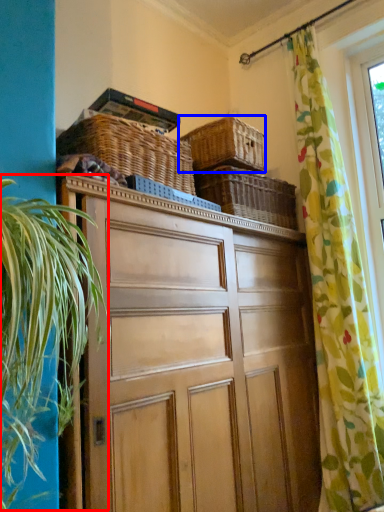
Question: Among these objects, which one is farthest to the camera, vegetation (highlighted by a red box) or basket (highlighted by a blue box)?

Choices:
 (A) vegetation
 (B) basket

Answer: (B)